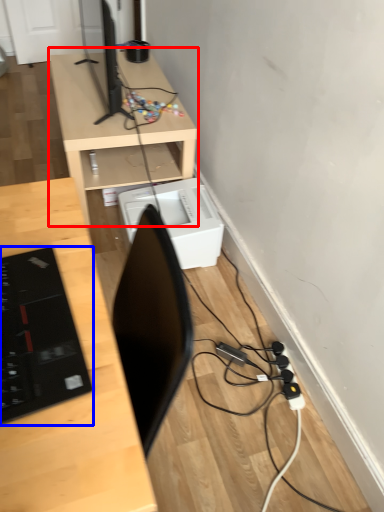
Question: Which of the following is the farthest to the observer, desk (highlighted by a red box) or laptop (highlighted by a blue box)?

Choices:
 (A) desk
 (B) laptop

Answer: (A)